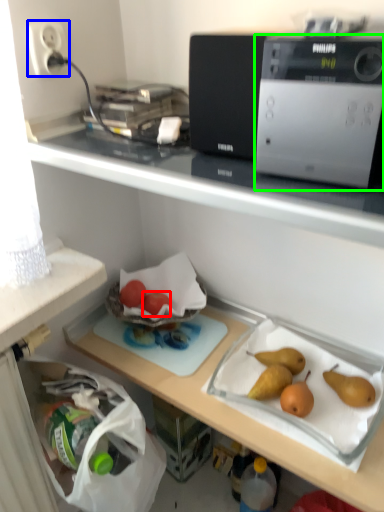
Question: Estimate the real-world distances between objects in this image. Which object is farther from fruit (highlighted by a red box), electric outlet (highlighted by a blue box) or home appliance (highlighted by a green box)?

Choices:
 (A) electric outlet
 (B) home appliance

Answer: (B)